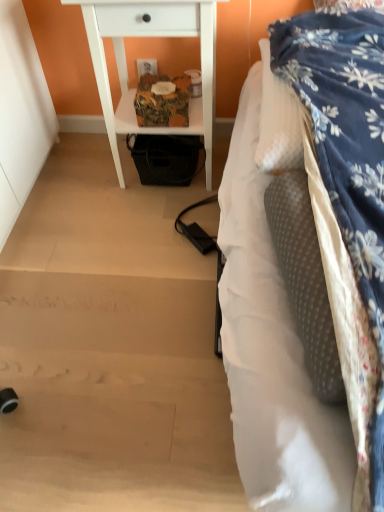
Locate an element on the screen. This screenshot has height=512, width=384. free space to the left of white wood nightstand at upper center is located at coordinates (84, 182).